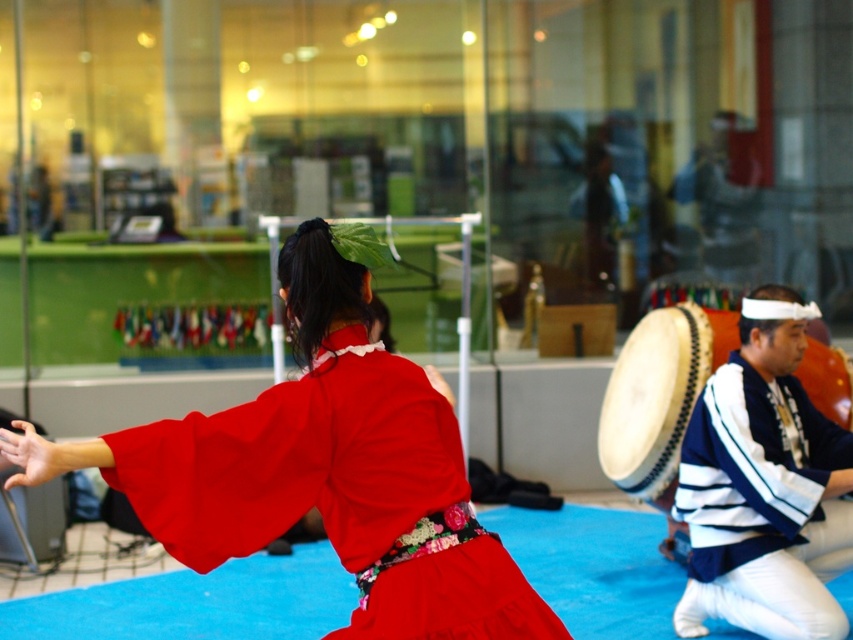
You are standing at the point marked as point (323, 470) in the image. What object is directly in front of you?

The matte red kimono at center is directly in front of you at point (323, 470).